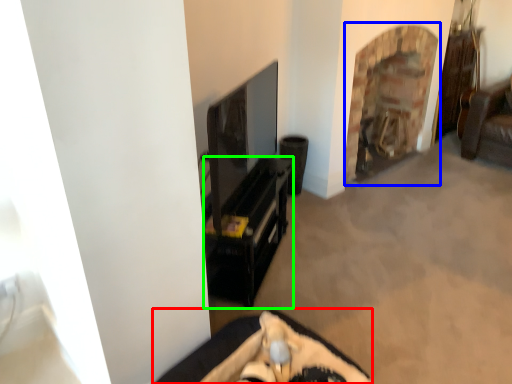
Question: Based on their relative distances, which object is nearer to furniture (highlighted by a red box)? Choose from fireplace (highlighted by a blue box) and furniture (highlighted by a green box).

Choices:
 (A) fireplace
 (B) furniture

Answer: (B)